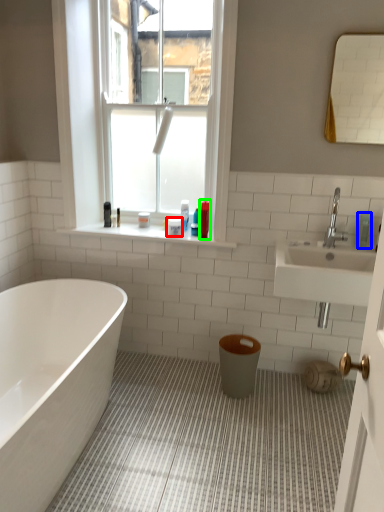
Question: Based on their relative distances, which object is farther from toiletry (highlighted by a red box)? Choose from toiletry (highlighted by a blue box) and toiletry (highlighted by a green box).

Choices:
 (A) toiletry
 (B) toiletry

Answer: (A)